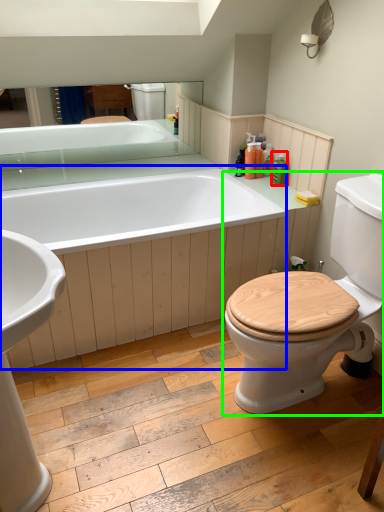
Question: Based on their relative distances, which object is nearer to toiletry (highlighted by a red box)? Choose from bath (highlighted by a blue box) and toilet (highlighted by a green box).

Choices:
 (A) bath
 (B) toilet

Answer: (A)